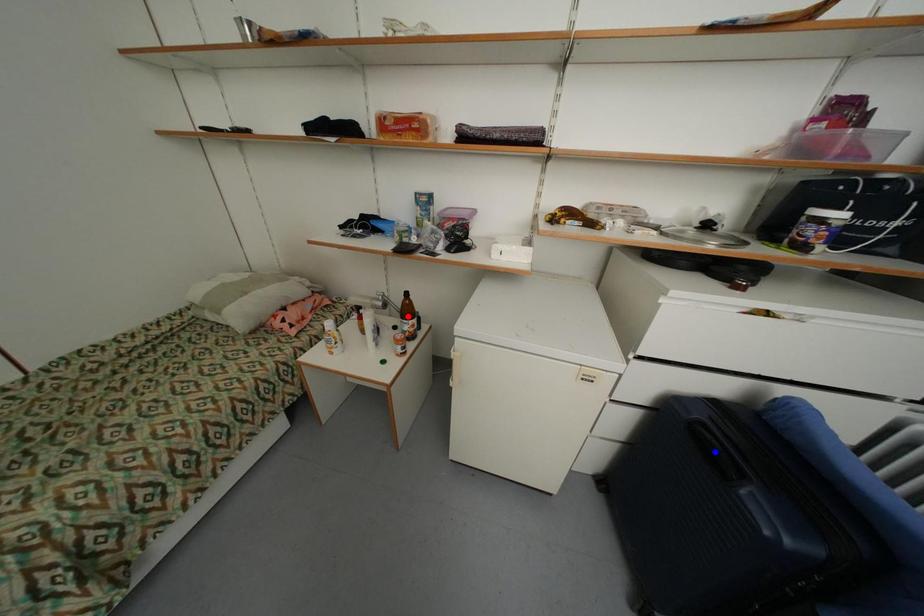
Question: Two points are marked on the image. Which point is closer to the camera?

Choices:
 (A) Blue point is closer.
 (B) Red point is closer.

Answer: (A)